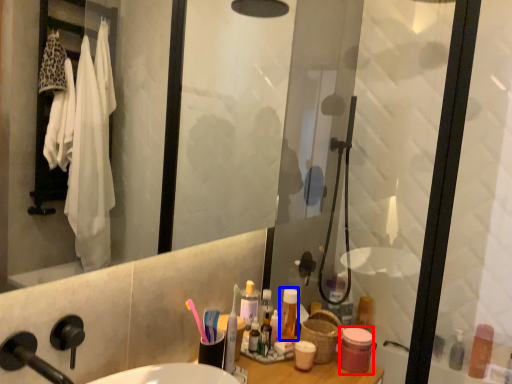
Question: Which object is further to the camera taking this photo, toiletry (highlighted by a red box) or toiletry (highlighted by a blue box)?

Choices:
 (A) toiletry
 (B) toiletry

Answer: (B)